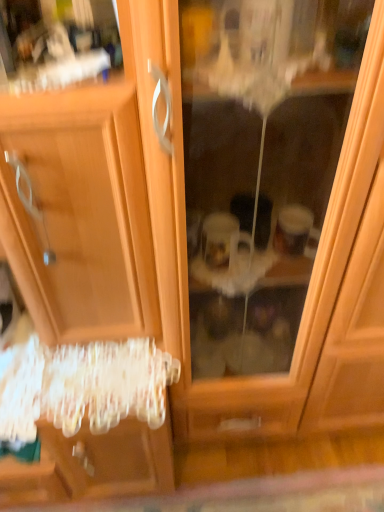
Describe the element at coordinates (102, 197) in the screenshot. This screenshot has width=384, height=512. I see `wooden dresser at left` at that location.

I want to click on wooden dresser at left, so click(102, 197).

Find the location of a particular element. This screenshot has height=512, width=384. transparent plastic screen door at left is located at coordinates (309, 285).

What do you see at coordinates (309, 285) in the screenshot? I see `transparent plastic screen door at left` at bounding box center [309, 285].

Find the location of a particular element. wooden dresser at left is located at coordinates (102, 197).

Considering the relative positions of transparent plastic screen door at left and wooden dresser at left in the image provided, is transparent plastic screen door at left to the left or to the right of wooden dresser at left?

From the image, it's evident that transparent plastic screen door at left is to the right of wooden dresser at left.

Does transparent plastic screen door at left lie behind wooden dresser at left?

Yes, it is.

Does point (326, 288) come in front of point (39, 252)?

No.

From the image's perspective, is transparent plastic screen door at left on wooden dresser at left?

Yes.

From a real-world perspective, is transparent plastic screen door at left physically below wooden dresser at left?

Yes, from a real-world perspective, transparent plastic screen door at left is beneath wooden dresser at left.

Does transparent plastic screen door at left have a lesser width compared to wooden dresser at left?

Correct, the width of transparent plastic screen door at left is less than that of wooden dresser at left.

Which of these two, transparent plastic screen door at left or wooden dresser at left, stands shorter?

transparent plastic screen door at left is shorter.

From the picture: Considering the sizes of objects transparent plastic screen door at left and wooden dresser at left in the image provided, who is bigger, transparent plastic screen door at left or wooden dresser at left?

Bigger between the two is wooden dresser at left.

Choose the correct answer: Is transparent plastic screen door at left inside wooden dresser at left or outside it?

transparent plastic screen door at left is outside wooden dresser at left.

In the scene shown: Are transparent plastic screen door at left and wooden dresser at left located far from each other?

transparent plastic screen door at left is actually quite close to wooden dresser at left.

Is transparent plastic screen door at left oriented towards wooden dresser at left?

No.

How much distance is there between transparent plastic screen door at left and wooden dresser at left?

transparent plastic screen door at left is 13.29 inches away from wooden dresser at left.

The width and height of the screenshot is (384, 512). What are the coordinates of `dresser in front of the transparent plastic screen door at left` in the screenshot? It's located at (102, 197).

Considering the relative positions of wooden dresser at left and transparent plastic screen door at left in the image provided, is wooden dresser at left to the right of transparent plastic screen door at left from the viewer's perspective?

Incorrect, wooden dresser at left is not on the right side of transparent plastic screen door at left.

Considering the positions of objects wooden dresser at left and transparent plastic screen door at left in the image provided, who is in front, wooden dresser at left or transparent plastic screen door at left?

wooden dresser at left is in front.

Is point (127, 207) positioned after point (335, 207)?

Yes, point (127, 207) is farther from viewer.

From the image's perspective, which is below, wooden dresser at left or transparent plastic screen door at left?

wooden dresser at left appears lower in the image.

From a real-world perspective, who is located higher, wooden dresser at left or transparent plastic screen door at left?

Result: In real-world perspective, wooden dresser at left is above.

Considering the sizes of objects wooden dresser at left and transparent plastic screen door at left in the image provided, who is thinner, wooden dresser at left or transparent plastic screen door at left?

transparent plastic screen door at left.

Consider the image. Between wooden dresser at left and transparent plastic screen door at left, which one has less height?

transparent plastic screen door at left.

Is wooden dresser at left bigger than transparent plastic screen door at left?

Indeed, wooden dresser at left has a larger size compared to transparent plastic screen door at left.

Is wooden dresser at left outside of transparent plastic screen door at left?

wooden dresser at left lies outside transparent plastic screen door at left's area.

Are wooden dresser at left and transparent plastic screen door at left located far from each other?

No, wooden dresser at left is not far from transparent plastic screen door at left.

Is wooden dresser at left oriented away from transparent plastic screen door at left?

That's not correct — wooden dresser at left is not looking away from transparent plastic screen door at left.

Locate an element on the screen. The image size is (384, 512). screen door above the wooden dresser at left (from the image's perspective) is located at coordinates (309, 285).

Where is `screen door on the right of wooden dresser at left`? The height and width of the screenshot is (512, 384). screen door on the right of wooden dresser at left is located at coordinates (309, 285).

Where is `dresser below the transparent plastic screen door at left (from the image's perspective)`? dresser below the transparent plastic screen door at left (from the image's perspective) is located at coordinates (102, 197).